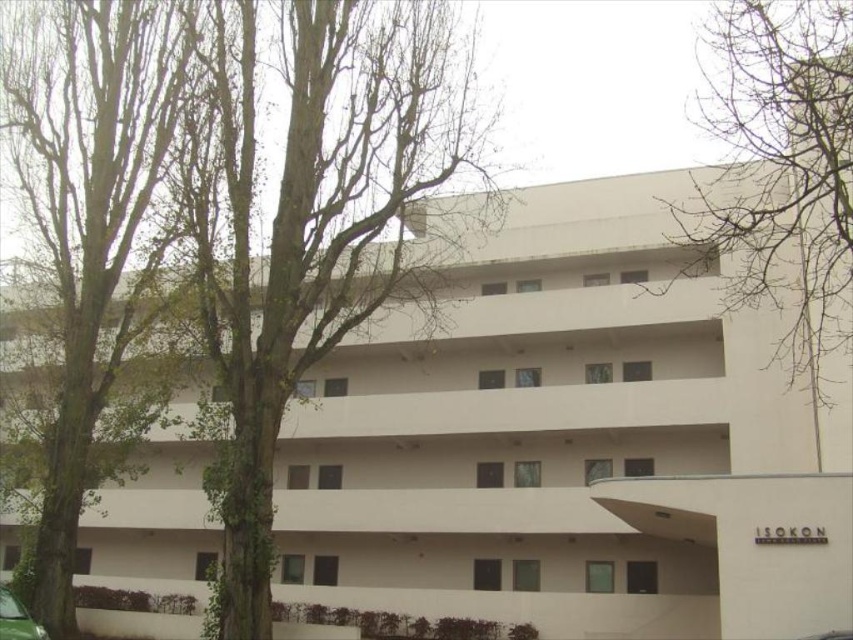
Question: Does green leafy tree at left lie behind bare branches at upper right?

Choices:
 (A) no
 (B) yes

Answer: (B)

Question: In this image, where is green leafy tree at left located relative to green matte car at lower left?

Choices:
 (A) above
 (B) below

Answer: (A)

Question: Which point is farther to the camera?

Choices:
 (A) (19, 634)
 (B) (366, 29)

Answer: (B)

Question: Which of the following is the closest to the observer?

Choices:
 (A) (769, 294)
 (B) (30, 632)
 (C) (328, 16)

Answer: (B)

Question: Based on their relative distances, which object is nearer to the green matte car at lower left?

Choices:
 (A) green leafy tree at left
 (B) bare branches at upper right

Answer: (A)

Question: Is the position of bare branches at upper right more distant than that of green matte car at lower left?

Choices:
 (A) no
 (B) yes

Answer: (A)